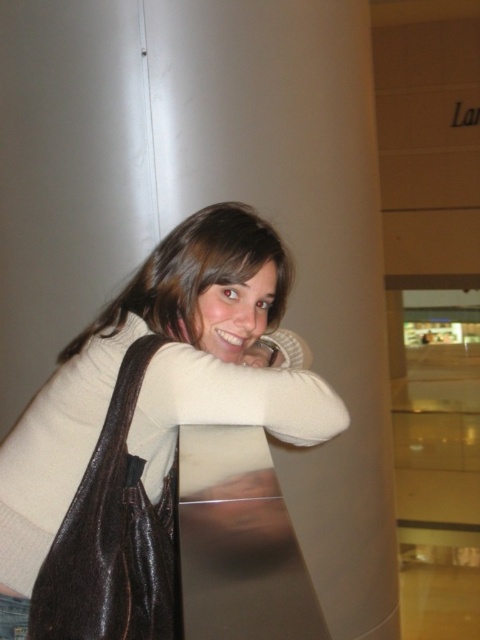
You are standing in the mall and see the matte brown purse at center. Where exactly is it positioned in relation to the person and the pillar?

The matte brown purse at center is located at point coordinates of 0.667 on the x axis and 0.310 on the y axis.

You are a tailor who needs to measure the distance between two clothing items to ensure proper alterations. You see the matte beige sweater at center and the denim at left in the image. Can you determine if the distance between them is sufficient to allow a 30 inch long measuring tape to fully extend between them without needing to move either item?

The distance between the matte beige sweater at center and the denim at left is 34.76 inches, which is longer than the 30 inch measuring tape. Therefore, the tape can fully extend between them without moving either item.

You are a security guard in the mall and need to locate a lost item. The owner says it was last seen near the person in the image. They mention it was to the left of their denim at left. Is the matte brown purse at center a possible candidate?

The matte brown purse at center is positioned on the right side of denim at left, so it is not to the left of the denim. The lost item would need to be on the opposite side of the denim at left from the purse.